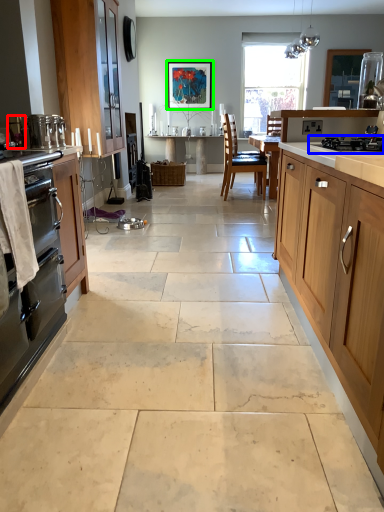
Question: Considering the real-world distances, which object is farthest from appliance (highlighted by a red box)? gas stove (highlighted by a blue box) or picture frame (highlighted by a green box)?

Choices:
 (A) gas stove
 (B) picture frame

Answer: (B)